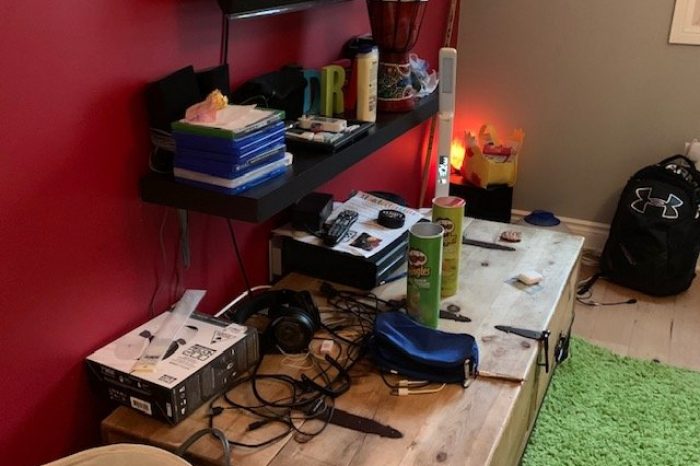
At what (x,y) coordinates should I click in order to perform the action: click on raised wooden plinth. Please return your answer as a coordinate pair (x, y). Looking at the image, I should click on (440, 426).